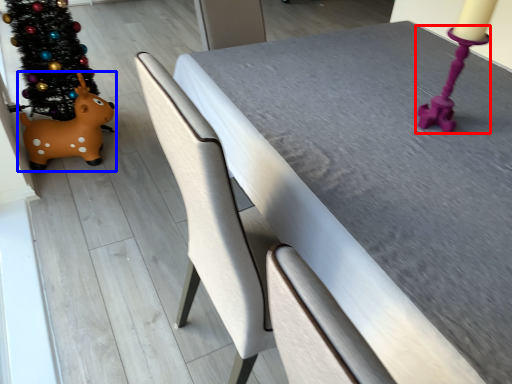
Question: Which object appears closest to the camera in this image, candle holder (highlighted by a red box) or toy (highlighted by a blue box)?

Choices:
 (A) candle holder
 (B) toy

Answer: (A)